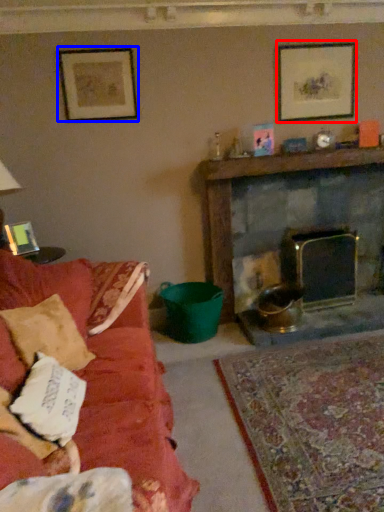
Question: Which of the following is the closest to the observer, picture frame (highlighted by a red box) or picture frame (highlighted by a blue box)?

Choices:
 (A) picture frame
 (B) picture frame

Answer: (B)